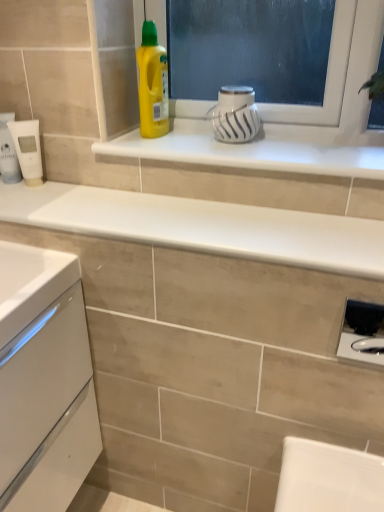
I want to click on vacant area in front of yellow plastic bottle at upper center, so click(x=158, y=148).